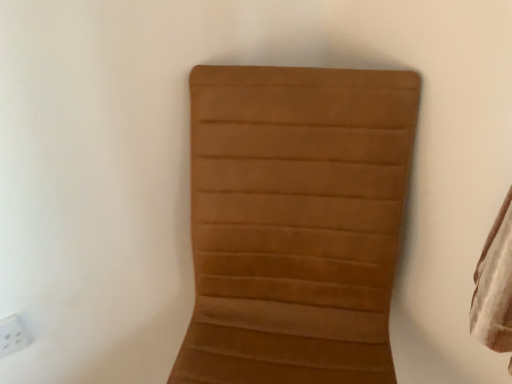
Question: Relative to brown suede chair at center, is white plastic electric outlet at lower left in front or behind?

Choices:
 (A) front
 (B) behind

Answer: (B)

Question: Considering the relative positions of white plastic electric outlet at lower left and brown suede chair at center in the image provided, is white plastic electric outlet at lower left to the left or to the right of brown suede chair at center?

Choices:
 (A) right
 (B) left

Answer: (B)

Question: Is white plastic electric outlet at lower left wider or thinner than brown suede chair at center?

Choices:
 (A) wide
 (B) thin

Answer: (B)

Question: Looking at the image, does brown suede chair at center seem bigger or smaller compared to white plastic electric outlet at lower left?

Choices:
 (A) small
 (B) big

Answer: (B)

Question: Visually, is brown suede chair at center positioned to the left or to the right of white plastic electric outlet at lower left?

Choices:
 (A) right
 (B) left

Answer: (A)

Question: From a real-world perspective, is brown suede chair at center positioned above or below white plastic electric outlet at lower left?

Choices:
 (A) above
 (B) below

Answer: (B)

Question: From the image's perspective, is brown suede chair at center above or below white plastic electric outlet at lower left?

Choices:
 (A) above
 (B) below

Answer: (B)